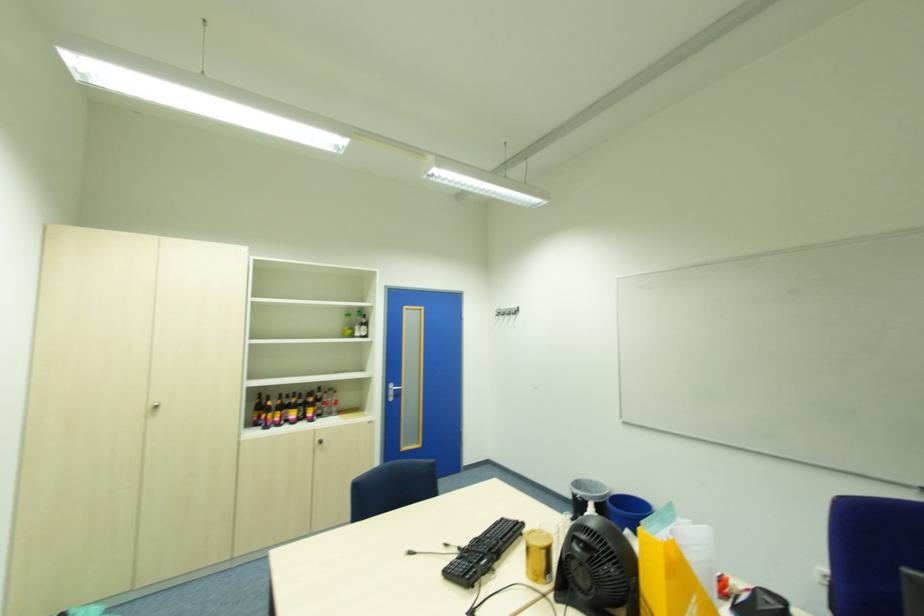
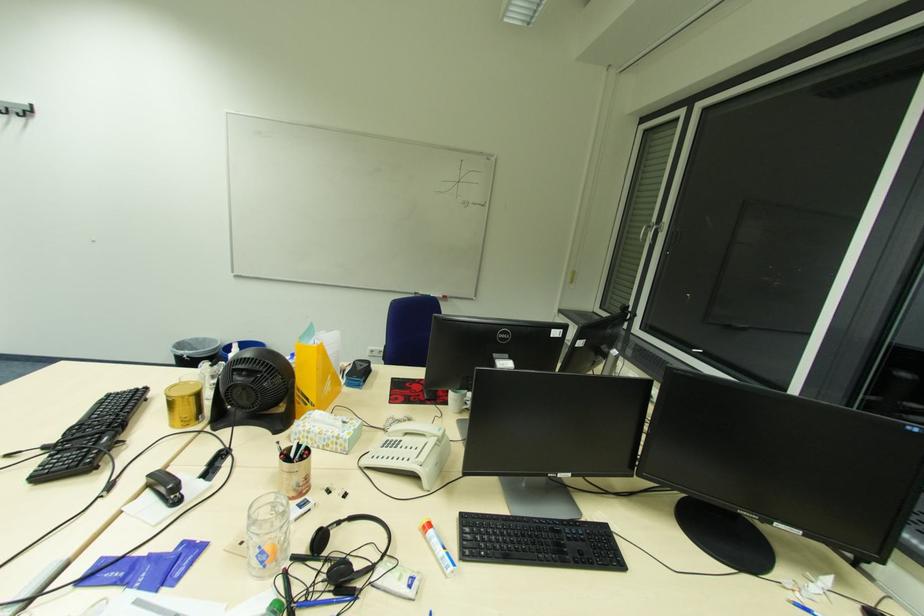
The images are taken continuously from a first-person perspective. In which direction is your viewpoint rotating?

The rotation direction of the camera is right-down.